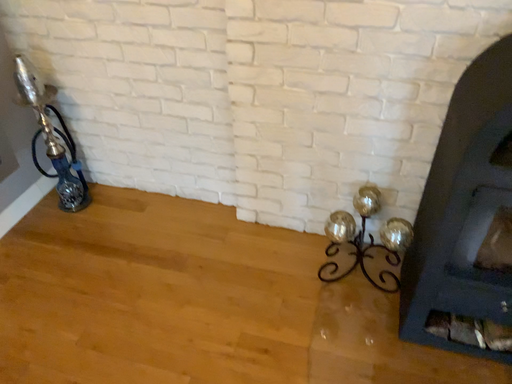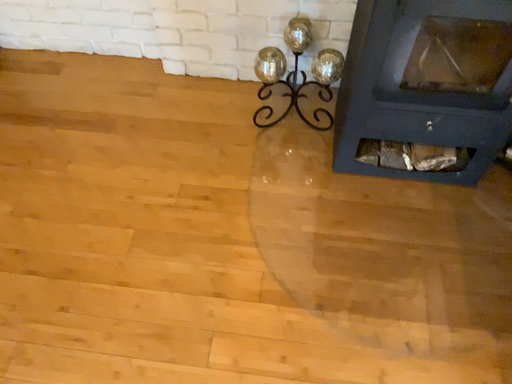
Question: How did the camera likely rotate when shooting the video?

Choices:
 (A) rotated left
 (B) rotated right

Answer: (B)